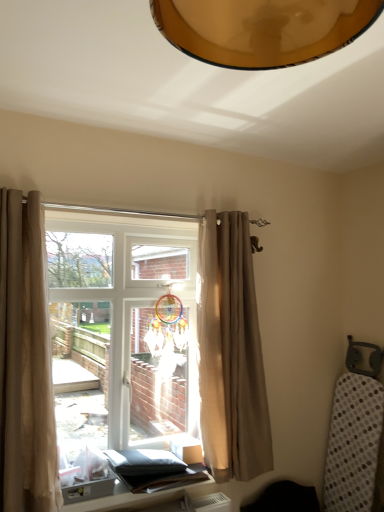
What are the coordinates of `beige fabric curtain at center, acting as the 2th curtain starting from the left` in the screenshot? It's located at (230, 352).

Where is `beige fabric curtain at left, the first curtain from the front`? beige fabric curtain at left, the first curtain from the front is located at coordinates (26, 359).

This screenshot has height=512, width=384. What do you see at coordinates (26, 359) in the screenshot?
I see `beige fabric curtain at left, the 1th curtain positioned from the left` at bounding box center [26, 359].

The width and height of the screenshot is (384, 512). In order to click on beige fabric curtain at center, acting as the 2th curtain starting from the left in this screenshot , I will do `click(230, 352)`.

From a real-world perspective, which is physically below, beige fabric curtain at center, acting as the 2th curtain starting from the left, or matte black table at lower center?

matte black table at lower center, from a real-world perspective.

From the image's perspective, is beige fabric curtain at center, which ranks as the 2th curtain in front-to-back order, located above or below matte black table at lower center?

beige fabric curtain at center, which ranks as the 2th curtain in front-to-back order, is situated higher than matte black table at lower center in the image.

Is beige fabric curtain at center, which appears as the 1th curtain when viewed from the right, bigger than matte black table at lower center?

Correct, beige fabric curtain at center, which appears as the 1th curtain when viewed from the right, is larger in size than matte black table at lower center.

Is translucent glass window at center facing away from beige fabric curtain at left, the first curtain from the front?

Yes, translucent glass window at center's orientation is away from beige fabric curtain at left, the first curtain from the front.

Can you confirm if translucent glass window at center is bigger than beige fabric curtain at left, which is the second curtain in right-to-left order?

Correct, translucent glass window at center is larger in size than beige fabric curtain at left, which is the second curtain in right-to-left order.

Is translucent glass window at center not close to beige fabric curtain at left, the 2th curtain from the back?

They are positioned close to each other.

What's the angular difference between translucent glass window at center and beige fabric curtain at left, the 2th curtain from the back,'s facing directions?

They differ by 0.232 degrees in their facing directions.

From the image's perspective, is translucent glass window at center located above matte black table at lower center?

Indeed, from the image's perspective, translucent glass window at center is shown above matte black table at lower center.

Considering the relative sizes of translucent glass window at center and matte black table at lower center in the image provided, is translucent glass window at center taller than matte black table at lower center?

Indeed, translucent glass window at center has a greater height compared to matte black table at lower center.

Where is `table that appears below the translucent glass window at center (from a real-world perspective)`? The width and height of the screenshot is (384, 512). table that appears below the translucent glass window at center (from a real-world perspective) is located at coordinates (140, 492).

Looking at the image, does translucent glass window at center seem bigger or smaller compared to matte black table at lower center?

In the image, translucent glass window at center appears to be larger than matte black table at lower center.

Which is behind, point (251, 294) or point (148, 382)?

The point (148, 382) is farther from the camera.

Which of these two, beige fabric curtain at center, which appears as the 1th curtain when viewed from the right, or translucent glass window at center, stands taller?

→ beige fabric curtain at center, which appears as the 1th curtain when viewed from the right, is taller.

Considering the sizes of objects beige fabric curtain at center, which ranks as the 2th curtain in front-to-back order, and translucent glass window at center in the image provided, who is thinner, beige fabric curtain at center, which ranks as the 2th curtain in front-to-back order, or translucent glass window at center?

With smaller width is beige fabric curtain at center, which ranks as the 2th curtain in front-to-back order.

Does beige fabric curtain at center, which appears as the 1th curtain when viewed from the right, have a larger size compared to translucent glass window at center?

No, beige fabric curtain at center, which appears as the 1th curtain when viewed from the right, is not bigger than translucent glass window at center.

From the image's perspective, is matte black table at lower center above beige fabric curtain at center, which appears as the 1th curtain when viewed from the right?

No, from the image's perspective, matte black table at lower center is not on top of beige fabric curtain at center, which appears as the 1th curtain when viewed from the right.

In the scene shown: From a real-world perspective, which is physically above, matte black table at lower center or beige fabric curtain at center, which appears as the 1th curtain when viewed from the right?

beige fabric curtain at center, which appears as the 1th curtain when viewed from the right, is physically above.

Can you confirm if matte black table at lower center is positioned to the left of beige fabric curtain at center, which ranks as the 2th curtain in front-to-back order?

Indeed, matte black table at lower center is positioned on the left side of beige fabric curtain at center, which ranks as the 2th curtain in front-to-back order.

Looking at this image, can you confirm if beige fabric curtain at left, the 2th curtain from the back, is smaller than translucent glass window at center?

Correct, beige fabric curtain at left, the 2th curtain from the back, occupies less space than translucent glass window at center.

Could you tell me if beige fabric curtain at left, the first curtain from the front, is facing translucent glass window at center?

Yes, beige fabric curtain at left, the first curtain from the front, faces towards translucent glass window at center.

Considering the sizes of beige fabric curtain at left, the 2th curtain from the back, and translucent glass window at center in the image, is beige fabric curtain at left, the 2th curtain from the back, taller or shorter than translucent glass window at center?

Clearly, beige fabric curtain at left, the 2th curtain from the back, is shorter compared to translucent glass window at center.

From the picture: Considering their positions, is beige fabric curtain at center, which ranks as the first curtain in back-to-front order, located in front of or behind beige fabric curtain at left, which is the second curtain in right-to-left order?

beige fabric curtain at center, which ranks as the first curtain in back-to-front order, is behind beige fabric curtain at left, which is the second curtain in right-to-left order.

From a real-world perspective, is beige fabric curtain at center, acting as the 2th curtain starting from the left, under beige fabric curtain at left, the 1th curtain positioned from the left?

Incorrect, from a real-world perspective, beige fabric curtain at center, acting as the 2th curtain starting from the left, is higher than beige fabric curtain at left, the 1th curtain positioned from the left.

Which of these two, beige fabric curtain at center, which ranks as the first curtain in back-to-front order, or beige fabric curtain at left, the 1th curtain positioned from the left, stands taller?

With more height is beige fabric curtain at center, which ranks as the first curtain in back-to-front order.

Is beige fabric curtain at center, which ranks as the first curtain in back-to-front order, oriented away from beige fabric curtain at left, the 2th curtain from the back?

No, beige fabric curtain at center, which ranks as the first curtain in back-to-front order,'s orientation is not away from beige fabric curtain at left, the 2th curtain from the back.

I want to click on curtain on the right of the matte black table at lower center, so click(x=230, y=352).

Locate an element on the screen. window behind the beige fabric curtain at left, the 1th curtain positioned from the left is located at coordinates (123, 328).

Based on their spatial positions, is translucent glass window at center or beige fabric curtain at center, which ranks as the first curtain in back-to-front order, closer to beige fabric curtain at left, the 2th curtain from the back?

translucent glass window at center is closer to beige fabric curtain at left, the 2th curtain from the back.

When comparing their distances from translucent glass window at center, does beige fabric curtain at left, the 1th curtain positioned from the left, or matte black table at lower center seem closer?

beige fabric curtain at left, the 1th curtain positioned from the left, lies closer to translucent glass window at center than the other object.

Estimate the real-world distances between objects in this image. Which object is closer to matte black table at lower center, translucent glass window at center or beige fabric curtain at center, acting as the 2th curtain starting from the left?

beige fabric curtain at center, acting as the 2th curtain starting from the left.

Which object lies further to the anchor point matte black table at lower center, beige fabric curtain at left, the 2th curtain from the back, or translucent glass window at center?

The object further to matte black table at lower center is translucent glass window at center.

Considering their positions, is translucent glass window at center positioned further to matte black table at lower center than beige fabric curtain at left, the 2th curtain from the back?

translucent glass window at center is positioned further to the anchor matte black table at lower center.

Based on their spatial positions, is beige fabric curtain at left, the 1th curtain positioned from the left, or translucent glass window at center closer to beige fabric curtain at center, which ranks as the first curtain in back-to-front order?

translucent glass window at center is positioned closer to the anchor beige fabric curtain at center, which ranks as the first curtain in back-to-front order.

Looking at the image, which one is located further to beige fabric curtain at left, which is the second curtain in right-to-left order, beige fabric curtain at center, which ranks as the first curtain in back-to-front order, or translucent glass window at center?

beige fabric curtain at center, which ranks as the first curtain in back-to-front order, lies further to beige fabric curtain at left, which is the second curtain in right-to-left order, than the other object.

Based on their spatial positions, is matte black table at lower center or beige fabric curtain at center, which appears as the 1th curtain when viewed from the right, closer to translucent glass window at center?

beige fabric curtain at center, which appears as the 1th curtain when viewed from the right, lies closer to translucent glass window at center than the other object.

I want to click on window between beige fabric curtain at left, the 1th curtain positioned from the left, and matte black table at lower center, in the vertical direction, so click(x=123, y=328).

This screenshot has height=512, width=384. What are the coordinates of `window between beige fabric curtain at left, which is the second curtain in right-to-left order, and beige fabric curtain at center, which ranks as the first curtain in back-to-front order, in the horizontal direction` in the screenshot? It's located at (123, 328).

Locate an element on the screen. Image resolution: width=384 pixels, height=512 pixels. window between beige fabric curtain at center, which appears as the 1th curtain when viewed from the right, and matte black table at lower center from top to bottom is located at coordinates (123, 328).

Locate an element on the screen. The image size is (384, 512). table situated between beige fabric curtain at left, the 1th curtain positioned from the left, and beige fabric curtain at center, acting as the 2th curtain starting from the left, from left to right is located at coordinates (140, 492).